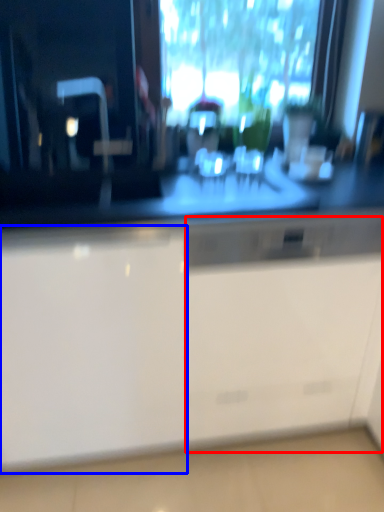
Question: Which point is further to the camera, file cabinet (highlighted by a red box) or cabinetry (highlighted by a blue box)?

Choices:
 (A) file cabinet
 (B) cabinetry

Answer: (A)